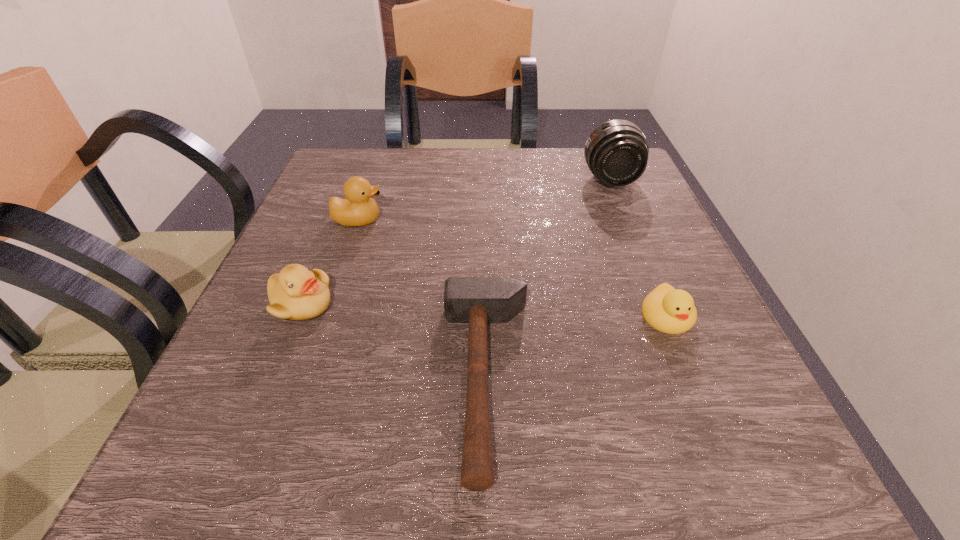
You are a GUI agent. You are given a task and a screenshot of the screen. Output one action in this format:
    pyautogui.click(x=<x>, y=<y>)
    Task: Click on the object that ranks as the second closest to the second shortest object
    
    Given the screenshot: What is the action you would take?
    pos(616,152)

Select which object appears as the third closest to the third object from right to left. Please provide its 2D coordinates. Your answer should be formatted as a tuple, i.e. [(x, y)], where the tuple contains the x and y coordinates of a point satisfying the conditions above.

[(358, 209)]

Identify the location of duckling that is the closest to the shortest duckling. The image size is (960, 540). (358, 209).

You are a GUI agent. You are given a task and a screenshot of the screen. Output one action in this format:
    pyautogui.click(x=<x>, y=<y>)
    Task: Click on the duckling that stands as the second closest to the third object from right to left
    The height and width of the screenshot is (540, 960).
    Given the screenshot: What is the action you would take?
    pyautogui.click(x=296, y=293)

Where is `blank area in the image that satisfies the following two spatial constraints: 1. at the front element of the tallest object; 2. on the face of the fourth nearest object`? The height and width of the screenshot is (540, 960). blank area in the image that satisfies the following two spatial constraints: 1. at the front element of the tallest object; 2. on the face of the fourth nearest object is located at coordinates (628, 220).

Locate an element on the screen. The width and height of the screenshot is (960, 540). free space that satisfies the following two spatial constraints: 1. on the face of the second shortest object; 2. on the striking surface of the hammer is located at coordinates (692, 379).